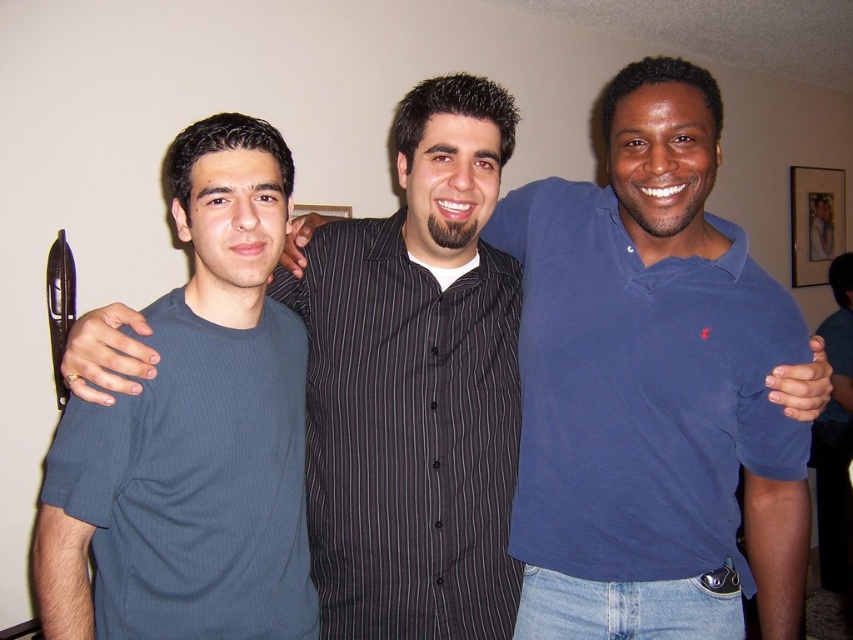
Looking at this image, who is positioned more to the left, dark blue ribbed t-shirt at left or wooden framed portrait at upper right?

Positioned to the left is dark blue ribbed t-shirt at left.

Is dark blue ribbed t-shirt at left positioned in front of wooden framed portrait at upper right?

Yes.

Is point (234, 132) less distant than point (822, 243)?

Yes.

Identify the location of dark blue ribbed t-shirt at left. The width and height of the screenshot is (853, 640). (194, 433).

Between black striped shirt at center and wooden framed portrait at upper right, which one appears on the left side from the viewer's perspective?

black striped shirt at center

What do you see at coordinates (407, 435) in the screenshot? This screenshot has height=640, width=853. I see `black striped shirt at center` at bounding box center [407, 435].

You are a GUI agent. You are given a task and a screenshot of the screen. Output one action in this format:
    pyautogui.click(x=<x>, y=<y>)
    Task: Click on the black striped shirt at center
    Image resolution: width=853 pixels, height=640 pixels.
    Given the screenshot: What is the action you would take?
    (x=407, y=435)

Where is `black striped shirt at center`? black striped shirt at center is located at coordinates (407, 435).

Is dark blue ribbed t-shirt at left in front of black striped shirt at center?

Yes, it is in front of black striped shirt at center.

Which is behind, point (173, 145) or point (379, 515)?

Positioned behind is point (379, 515).

The height and width of the screenshot is (640, 853). Identify the location of dark blue ribbed t-shirt at left. (194, 433).